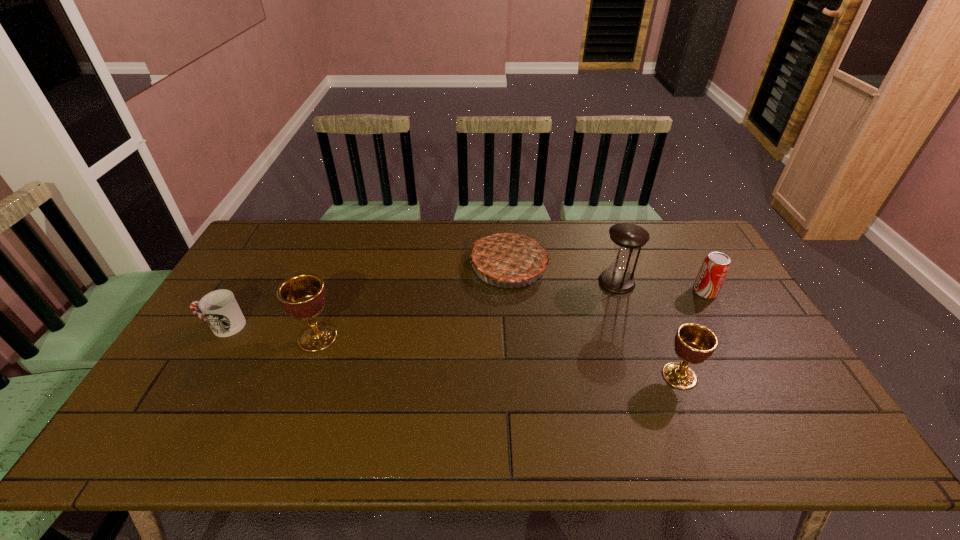
Locate an element on the screen. This screenshot has height=540, width=960. free area in between the hourglass and the shorter chalice is located at coordinates (648, 329).

What are the coordinates of `vacant space that is in between the hourglass and the fourth object from right to left` in the screenshot? It's located at (563, 274).

Identify the location of unoccupied position between the hourglass and the taller chalice. This screenshot has height=540, width=960. (468, 309).

The image size is (960, 540). I want to click on the third closest object to the fourth object from right to left, so coord(303,296).

Identify the location of the second closest object to the hourglass. The height and width of the screenshot is (540, 960). (715, 267).

Where is `free space that satisfies the following two spatial constraints: 1. on the front side of the hourglass; 2. on the left side of the pie`? Image resolution: width=960 pixels, height=540 pixels. free space that satisfies the following two spatial constraints: 1. on the front side of the hourglass; 2. on the left side of the pie is located at coordinates (510, 282).

Identify the location of vacant point that satisfies the following two spatial constraints: 1. on the handle side of the hourglass; 2. on the right side of the cup. (249, 282).

Where is `vacant region that satisfies the following two spatial constraints: 1. on the handle side of the soda can; 2. on the right side of the leftmost object`? This screenshot has height=540, width=960. vacant region that satisfies the following two spatial constraints: 1. on the handle side of the soda can; 2. on the right side of the leftmost object is located at coordinates (243, 292).

The width and height of the screenshot is (960, 540). I want to click on vacant region that satisfies the following two spatial constraints: 1. on the handle side of the hourglass; 2. on the right side of the cup, so click(x=249, y=282).

Locate an element on the screen. This screenshot has width=960, height=540. free spot that satisfies the following two spatial constraints: 1. on the front side of the third object from left to right; 2. on the right side of the rightmost object is located at coordinates (511, 292).